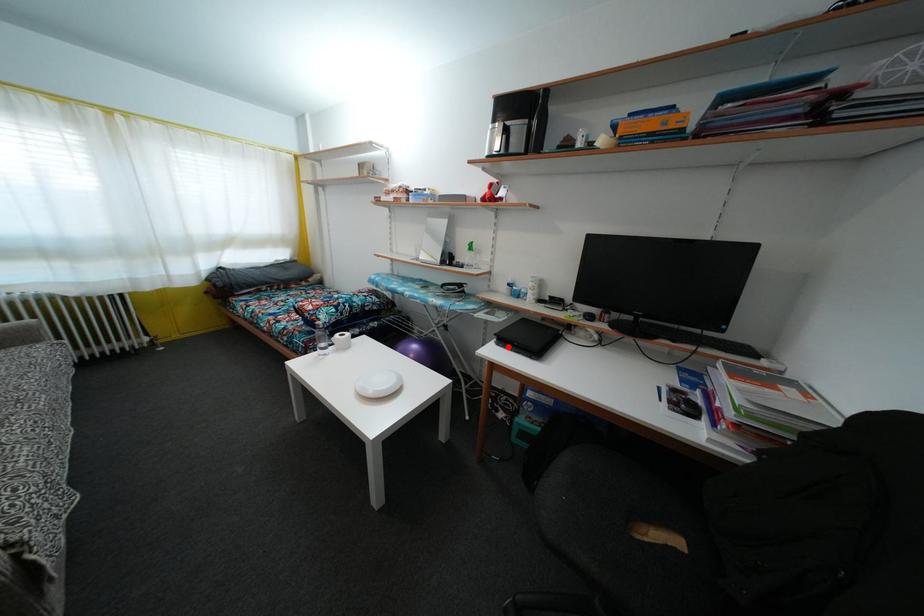
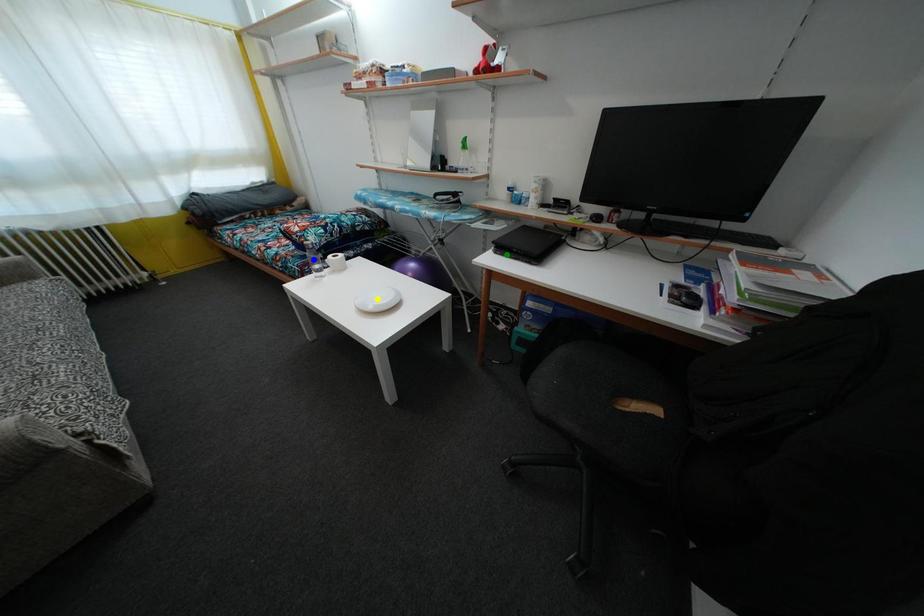
Question: I am providing you with two images of the same scene from different viewpoints. A red point is marked on the first image. You are given multiple points on the second image. Which mark in image 2 goes with the point in image 1?

Choices:
 (A) yellow point
 (B) green point
 (C) blue point

Answer: (B)